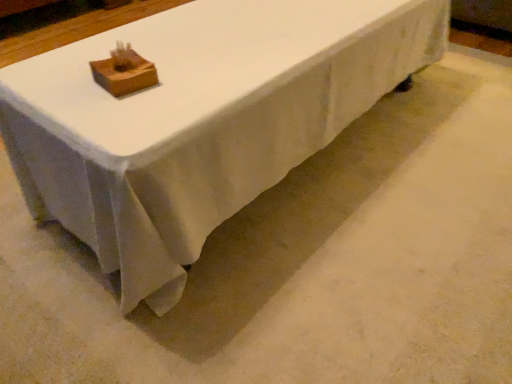
Question: Is wooden block at upper center in front of or behind white fabric table at center in the image?

Choices:
 (A) front
 (B) behind

Answer: (B)

Question: Considering the positions of wooden block at upper center and white fabric table at center in the image, is wooden block at upper center taller or shorter than white fabric table at center?

Choices:
 (A) short
 (B) tall

Answer: (A)

Question: In terms of width, does wooden block at upper center look wider or thinner when compared to white fabric table at center?

Choices:
 (A) wide
 (B) thin

Answer: (B)

Question: Do you think white fabric table at center is within wooden block at upper center, or outside of it?

Choices:
 (A) outside
 (B) inside

Answer: (A)

Question: From their relative heights in the image, would you say white fabric table at center is taller or shorter than wooden block at upper center?

Choices:
 (A) short
 (B) tall

Answer: (B)

Question: Is white fabric table at center bigger or smaller than wooden block at upper center?

Choices:
 (A) small
 (B) big

Answer: (B)

Question: From the image's perspective, is white fabric table at center located above or below wooden block at upper center?

Choices:
 (A) above
 (B) below

Answer: (A)